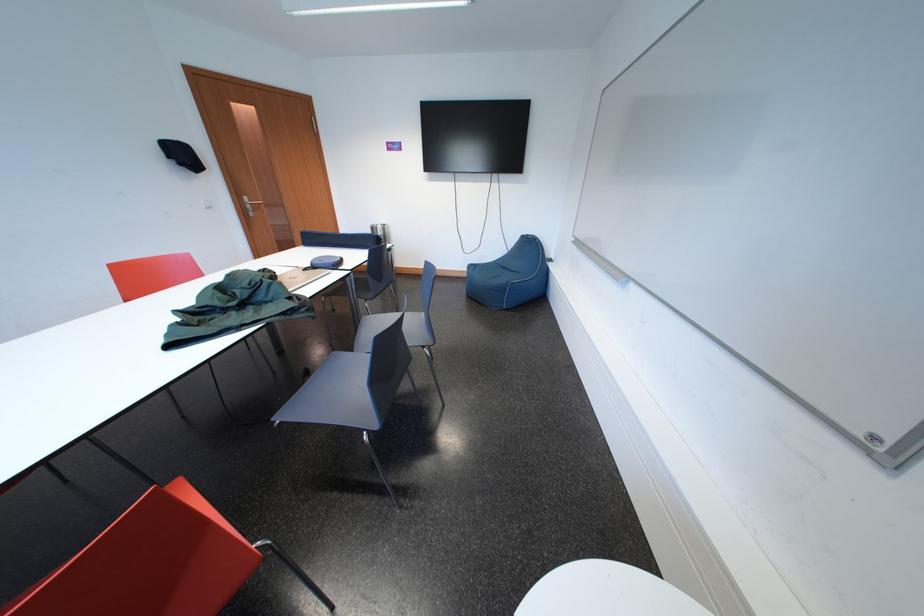
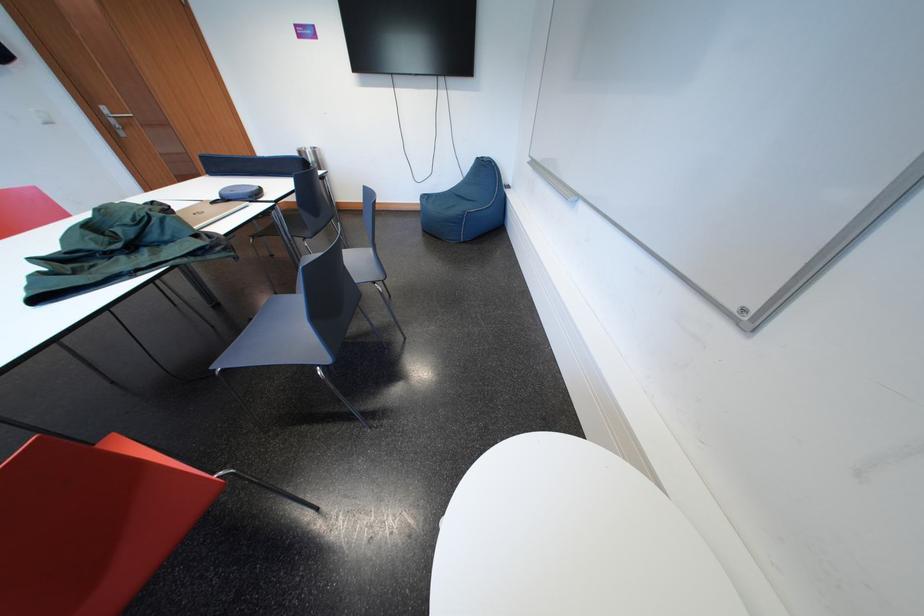
Locate, in the second image, the point that corresponds to (x=323, y=272) in the first image.

(235, 204)